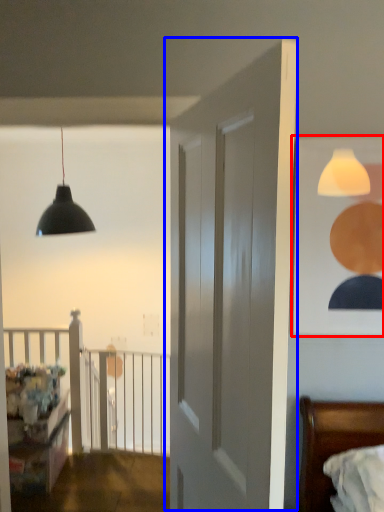
Question: Among these objects, which one is farthest to the camera, picture frame (highlighted by a red box) or door (highlighted by a blue box)?

Choices:
 (A) picture frame
 (B) door

Answer: (A)